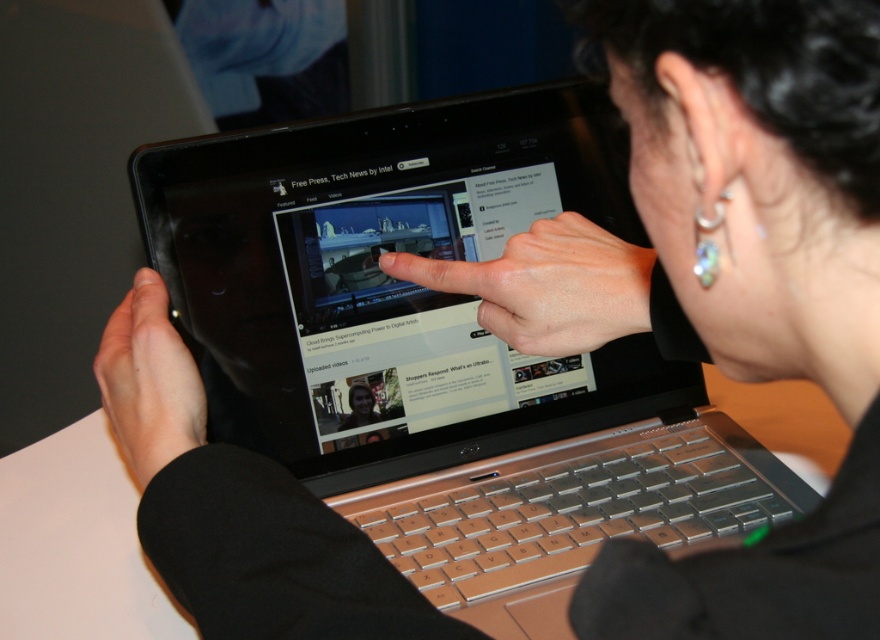
Question: Based on their relative distances, which object is farther from the matte black screen at center?

Choices:
 (A) matte black tablet at upper center
 (B) matte black finger at center
 (C) silver metallic laptop at center

Answer: (A)

Question: Can you confirm if matte black screen at center is positioned above matte black tablet at upper center?

Choices:
 (A) yes
 (B) no

Answer: (A)

Question: Can you confirm if silver metallic laptop at center is positioned to the left of matte black screen at center?

Choices:
 (A) no
 (B) yes

Answer: (A)

Question: Which point appears farthest from the camera in this image?

Choices:
 (A) (569, 211)
 (B) (368, 394)
 (C) (144, 397)

Answer: (B)

Question: Is the position of matte black screen at center less distant than that of matte black tablet at upper center?

Choices:
 (A) no
 (B) yes

Answer: (A)

Question: Which point is farther to the camera?

Choices:
 (A) matte black finger at center
 (B) matte black tablet at upper center
 (C) silver metallic laptop at center
 (D) matte black screen at center

Answer: (D)